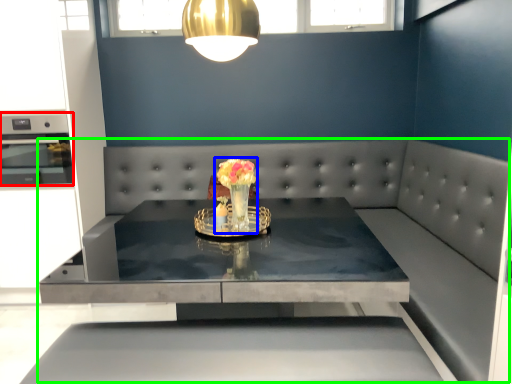
Question: Based on their relative distances, which object is nearer to appliance (highlighted by a red box)? Choose from floral arrangement (highlighted by a blue box) and couch (highlighted by a green box).

Choices:
 (A) floral arrangement
 (B) couch

Answer: (B)